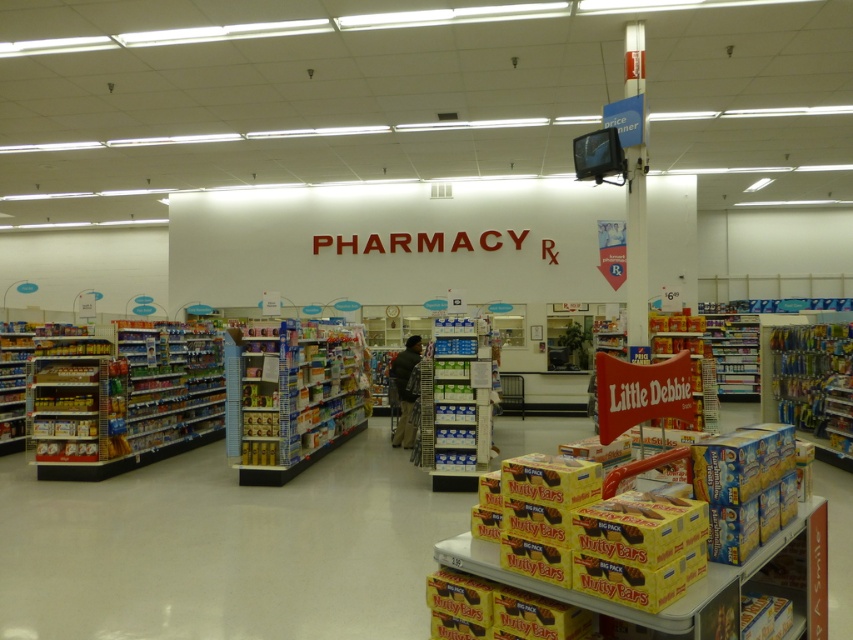
You are a customer in the pharmacy section of the store. You need to find the white cardboard shelf at center. According to the store layout, where would you look relative to the pharmacy sign?

The white cardboard shelf at center is located at point (456, 403), which is to the right and slightly below the pharmacy sign.

You are a customer in the pharmacy section of a store and want to reach the Nutty Bars display. You are currently standing at point (395, 442). Which direction should you move to get to the Nutty Bars display at point (316, 456)?

The point (316, 456) is in front of point (395, 442). So you should move forward towards the Nutty Bars display at point (316, 456).